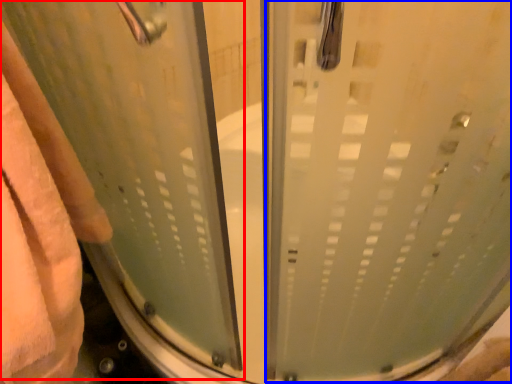
Question: Which object appears farthest to the camera in this image, screen door (highlighted by a red box) or screen door (highlighted by a blue box)?

Choices:
 (A) screen door
 (B) screen door

Answer: (B)